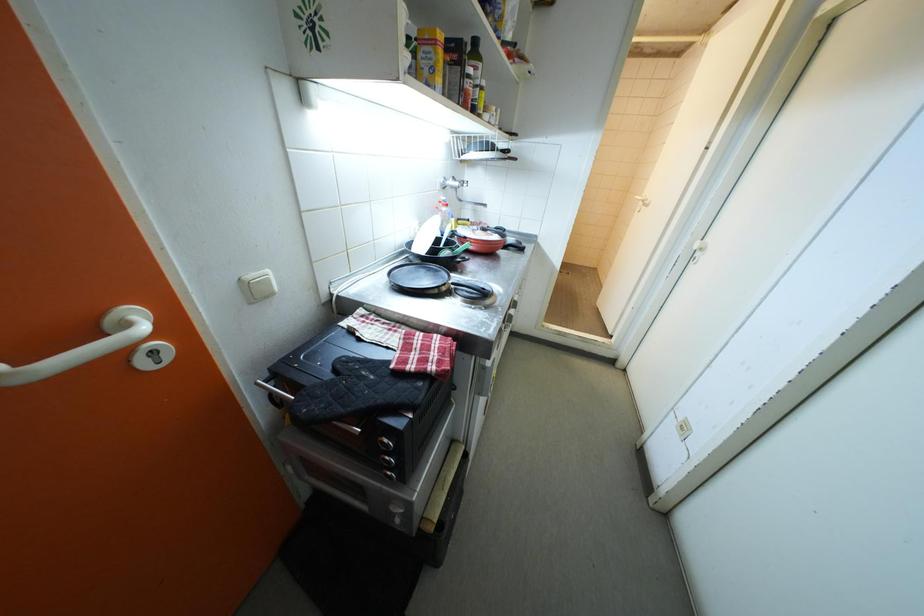
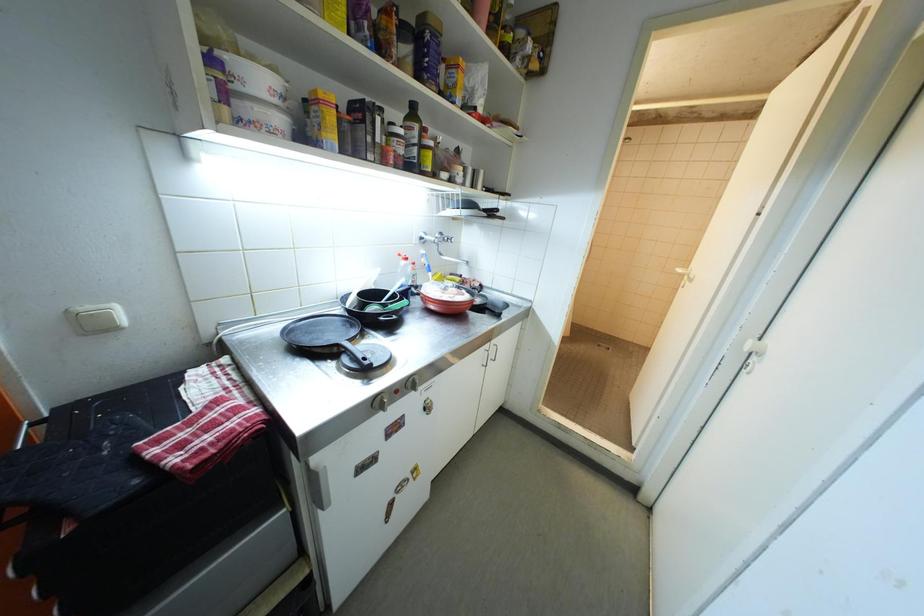
Question: The first image is from the beginning of the video and the second image is from the end. How did the camera likely rotate when shooting the video?

Choices:
 (A) Left
 (B) Right
 (C) Up
 (D) Down

Answer: (A)